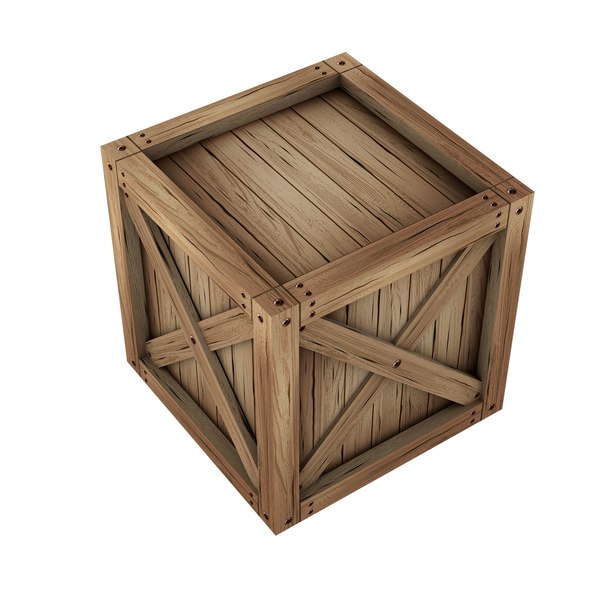
Find the location of a particular element. This screenshot has height=600, width=600. wood grain is located at coordinates (255, 228).